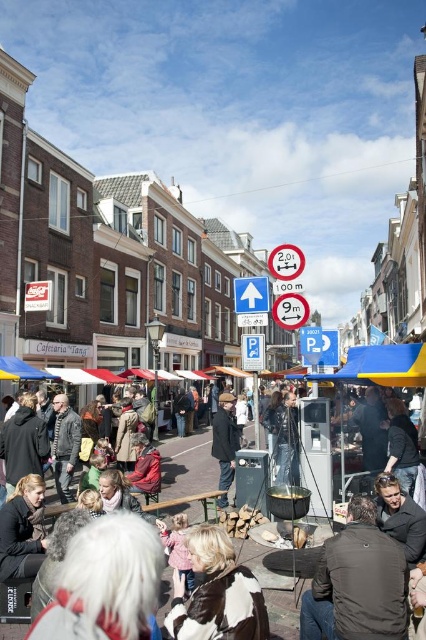
Is black-and-white fur coat at center behind blue fabric canopy at lower left?

No, black-and-white fur coat at center is in front of blue fabric canopy at lower left.

Can you confirm if black-and-white fur coat at center is wider than blue fabric canopy at lower left?

Indeed, black-and-white fur coat at center has a greater width compared to blue fabric canopy at lower left.

Which is in front, point (195, 596) or point (34, 369)?

Point (195, 596) is more forward.

This screenshot has height=640, width=426. I want to click on black-and-white fur coat at center, so click(216, 593).

Who is lower down, black-and-white fur coat at center or dark brown leather jacket at lower center?

black-and-white fur coat at center

Who is higher up, black-and-white fur coat at center or dark brown leather jacket at lower center?

dark brown leather jacket at lower center is higher up.

I want to click on black-and-white fur coat at center, so click(x=216, y=593).

Does dark gray jacket at center have a greater height compared to yellow fabric canopy at center?

Correct, dark gray jacket at center is much taller as yellow fabric canopy at center.

Image resolution: width=426 pixels, height=640 pixels. Describe the element at coordinates (357, 582) in the screenshot. I see `dark gray jacket at center` at that location.

You are a GUI agent. You are given a task and a screenshot of the screen. Output one action in this format:
    pyautogui.click(x=<x>, y=<y>)
    Task: Click on the dark gray jacket at center
    This screenshot has width=426, height=640.
    Given the screenshot: What is the action you would take?
    pyautogui.click(x=357, y=582)

At what (x,y) coordinates should I click in order to perform the action: click on dark gray jacket at center. Please return your answer as a coordinate pair (x, y). This screenshot has height=640, width=426. Looking at the image, I should click on (357, 582).